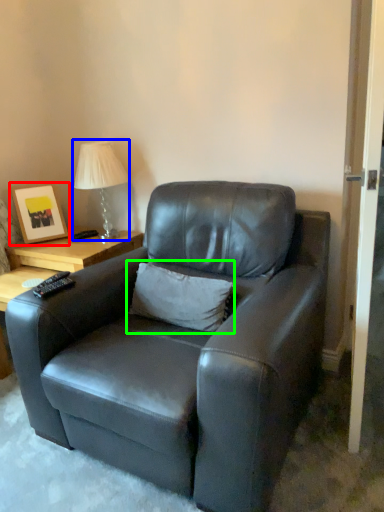
Question: Estimate the real-world distances between objects in this image. Which object is closer to picture frame (highlighted by a red box), table lamp (highlighted by a blue box) or pillow (highlighted by a green box)?

Choices:
 (A) table lamp
 (B) pillow

Answer: (A)